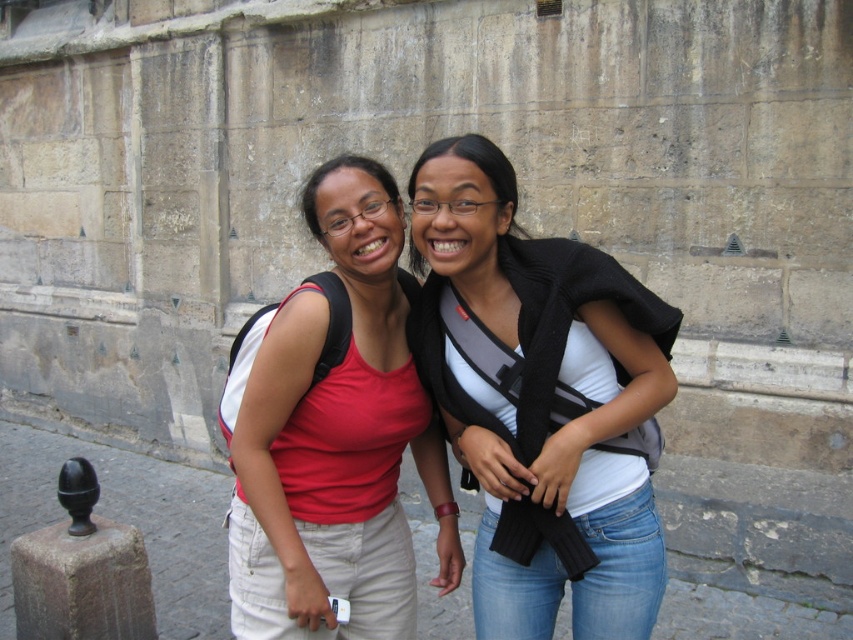
Question: Among these objects, which one is farthest from the camera?

Choices:
 (A) dark brown stone post at lower left
 (B) matte black scarf at center
 (C) matte red tank top at center
 (D) matte black sweater at center

Answer: (A)

Question: Does matte black sweater at center have a lesser width compared to matte black scarf at center?

Choices:
 (A) yes
 (B) no

Answer: (B)

Question: Can you confirm if matte red tank top at center is smaller than matte black scarf at center?

Choices:
 (A) yes
 (B) no

Answer: (B)

Question: Is the position of matte black sweater at center more distant than that of matte black scarf at center?

Choices:
 (A) yes
 (B) no

Answer: (B)

Question: Which object is positioned farthest from the matte black scarf at center?

Choices:
 (A) dark brown stone post at lower left
 (B) matte red tank top at center
 (C) matte black sweater at center

Answer: (A)

Question: Which of the following is the closest to the observer?

Choices:
 (A) matte red tank top at center
 (B) matte black scarf at center
 (C) matte black sweater at center
 (D) dark brown stone post at lower left

Answer: (C)